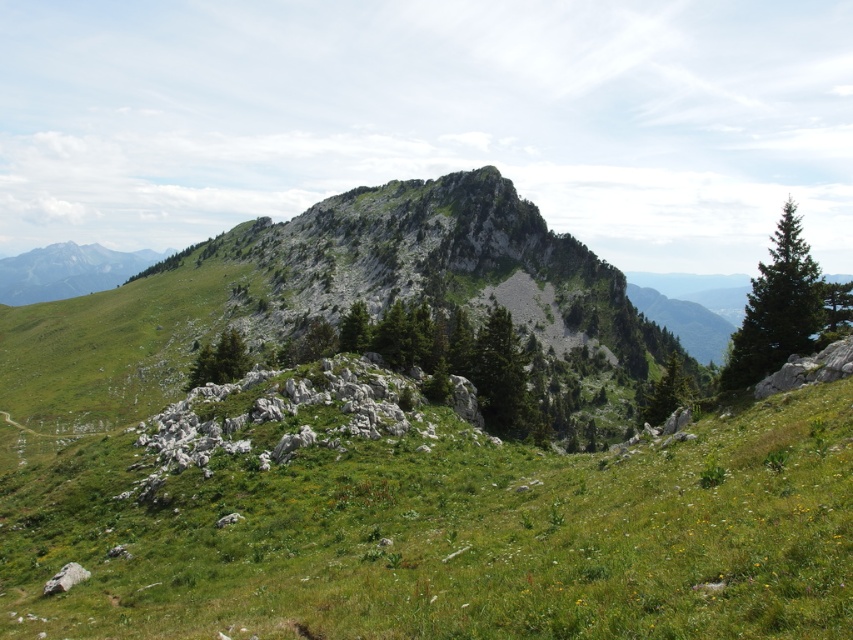
Between green matte tree at center and green matte tree at center-right, which one is positioned higher?

Positioned higher is green matte tree at center.

From the picture: Does green matte tree at center have a lesser height compared to green matte tree at center-right?

Indeed, green matte tree at center has a lesser height compared to green matte tree at center-right.

Describe the element at coordinates (219, 360) in the screenshot. This screenshot has height=640, width=853. I see `green matte tree at center` at that location.

At what (x,y) coordinates should I click in order to perform the action: click on green matte tree at center. Please return your answer as a coordinate pair (x, y). The image size is (853, 640). Looking at the image, I should click on (219, 360).

Does green grassy at center have a lesser height compared to green matte tree at center-right?

Yes, green grassy at center is shorter than green matte tree at center-right.

What do you see at coordinates (448, 532) in the screenshot? I see `green grassy at center` at bounding box center [448, 532].

The height and width of the screenshot is (640, 853). Find the location of `green grassy at center`. green grassy at center is located at coordinates (448, 532).

Which is in front, point (234, 237) or point (233, 365)?

Point (233, 365)

From the picture: How distant is rugged stone mountain at center from green matte tree at center?

80.38 meters

Which is behind, point (415, 195) or point (231, 380)?

The point (415, 195) is behind.

At what (x,y) coordinates should I click in order to perform the action: click on rugged stone mountain at center. Please return your answer as a coordinate pair (x, y). The image size is (853, 640). Looking at the image, I should click on click(323, 300).